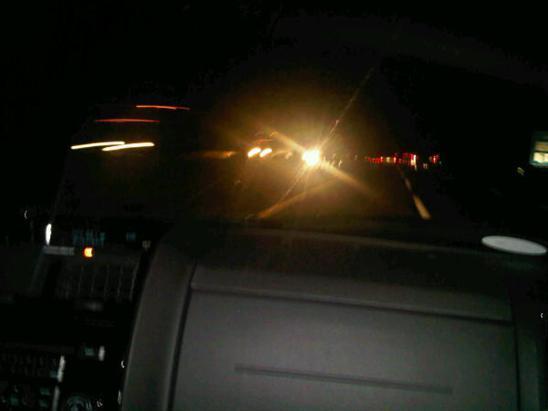
Locate an element on the screen. light is located at coordinates (102, 142).